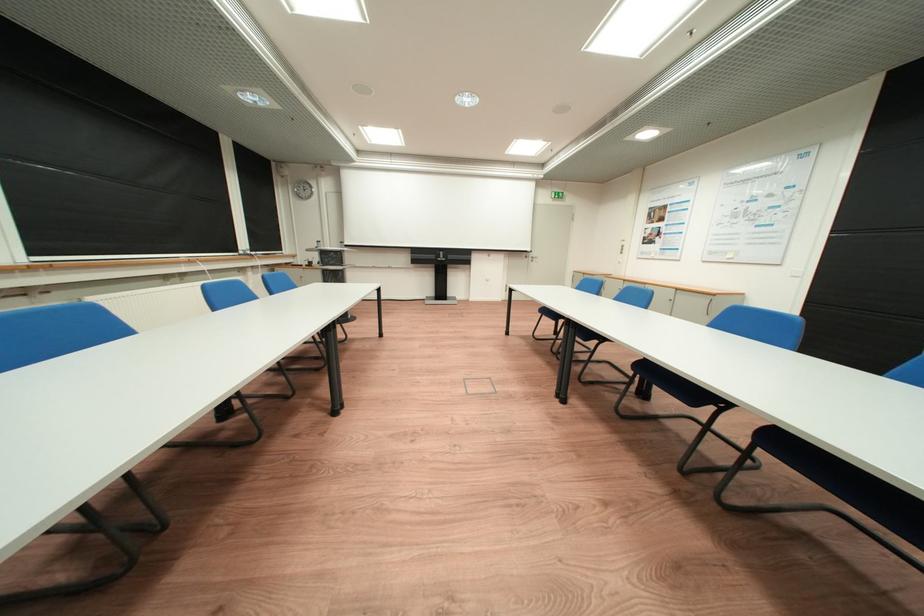
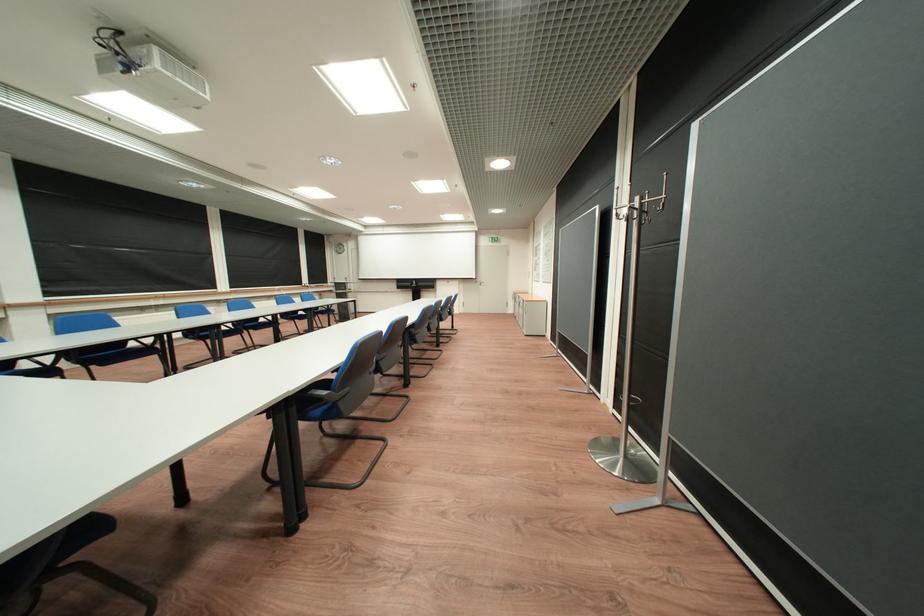
Find the pixel in the second image that matches point (541, 252) in the first image.

(487, 278)